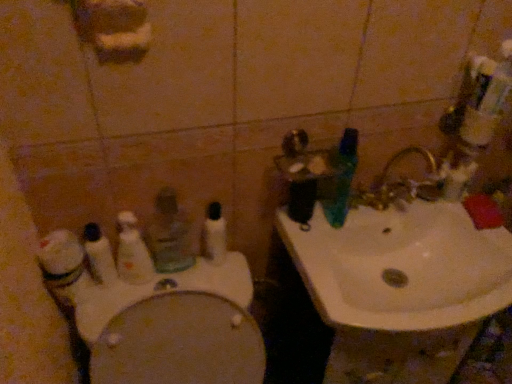
Question: Based on their positions, is white matte cleaning product at left located to the left or right of white plastic toothbrush at center, the second toothbrush in the right-to-left sequence?

Choices:
 (A) left
 (B) right

Answer: (A)

Question: Considering their positions, is white matte cleaning product at left located in front of or behind white plastic toothbrush at center, which is the third toothbrush from left to right?

Choices:
 (A) behind
 (B) front

Answer: (B)

Question: Considering the real-world distances, which object is farthest from the white glossy toilet at lower left?

Choices:
 (A) white plastic toothbrush at left, which appears as the fourth toothbrush when viewed from the right
 (B) white plastic toothbrush at center, which is the third toothbrush from left to right
 (C) translucent plastic mouthwash at center
 (D) white ceramic sink at upper right
 (E) white plastic toothbrush at left, which is the 3th toothbrush from right to left

Answer: (D)

Question: Which of these objects is positioned farthest from the white ceramic sink at upper right?

Choices:
 (A) green plastic toothbrush at upper right, the 1th toothbrush when ordered from right to left
 (B) white glossy toilet at lower left
 (C) white plastic toothbrush at left, arranged as the second toothbrush when viewed from the left
 (D) white plastic toothbrush at center, the second toothbrush in the right-to-left sequence
 (E) translucent plastic mouthwash at center

Answer: (C)